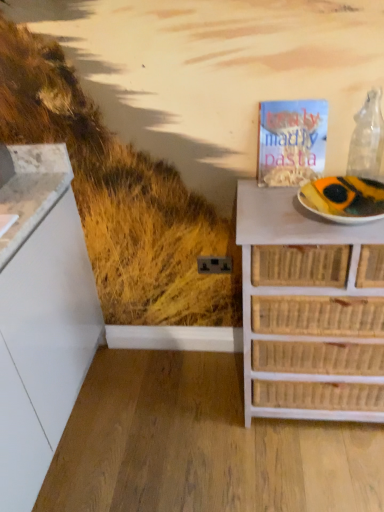
Where is `free point below white paper plate at right (from a real-world perspective)`? Image resolution: width=384 pixels, height=512 pixels. free point below white paper plate at right (from a real-world perspective) is located at coordinates (351, 216).